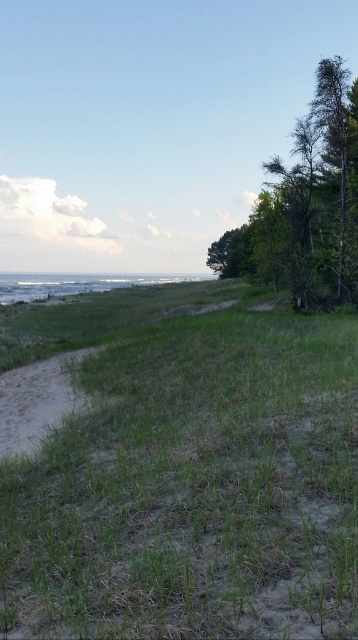
You are standing on the sandy dirt path at lower left and want to walk towards the dark green leafy tree at right. Is the tree taller than the path?

The dark green leafy tree at right is taller than the sandy dirt path at lower left, so yes, the tree is taller than the path.

You are standing at the lower left corner of the image and want to walk towards the sandy dirt path at lower left. Which direction should you move relative to the green grassy at lower left?

Since the green grassy at lower left is above the sandy dirt path at lower left, you should move downward from the green grassy at lower left to reach the sandy dirt path at lower left.

You are standing at the point marked by the coordinates point (180, 467) in the coastal landscape. Based on the scene description, what type of terrain are you currently standing on?

The point (180, 467) corresponds to green grassy at lower left, so you are standing on green grassy terrain.